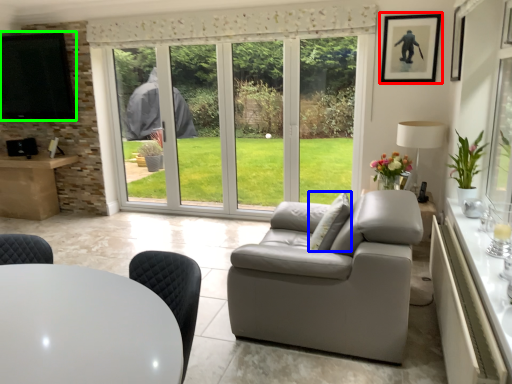
Question: Based on their relative distances, which object is farther from picture frame (highlighted by a red box)? Choose from pillow (highlighted by a blue box) and window screen (highlighted by a green box).

Choices:
 (A) pillow
 (B) window screen

Answer: (B)